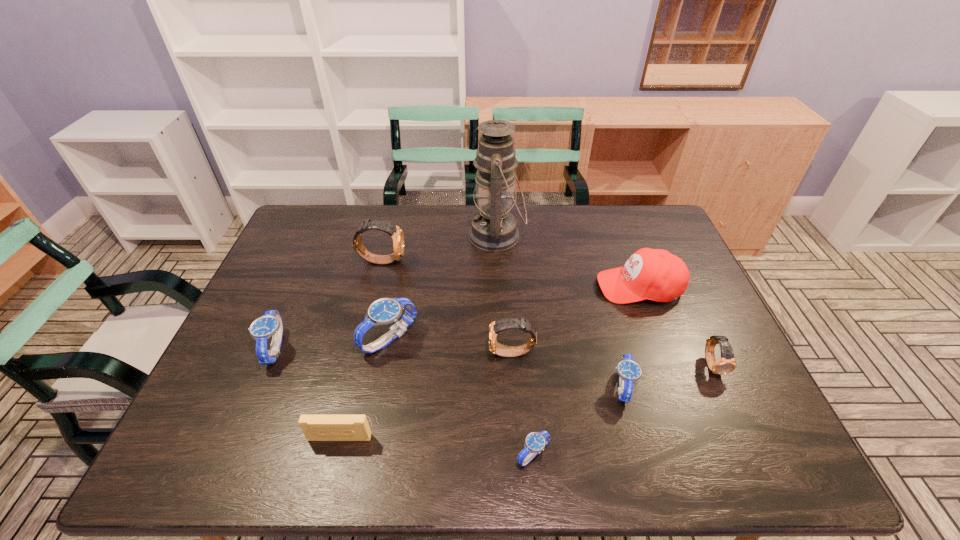
Image resolution: width=960 pixels, height=540 pixels. I want to click on vacant space that is in between the third blue watch from right to left and the shortest watch, so click(461, 396).

Find the location of a particular element. This screenshot has width=960, height=540. vacant space that's between the sixth tallest watch and the leftmost watch is located at coordinates (448, 368).

You are a GUI agent. You are given a task and a screenshot of the screen. Output one action in this format:
    pyautogui.click(x=<x>, y=<y>)
    Task: Click on the free area in between the second shortest watch and the third blue watch from right to left
    
    Given the screenshot: What is the action you would take?
    pyautogui.click(x=506, y=363)

The height and width of the screenshot is (540, 960). In order to click on vacant region between the smallest gold watch and the baseball cap in this screenshot , I will do `click(676, 326)`.

The image size is (960, 540). In order to click on vacant area that lies between the tallest object and the nearest blue watch in this screenshot , I will do `click(515, 345)`.

The height and width of the screenshot is (540, 960). I want to click on free space between the third blue watch from right to left and the leftmost watch, so coord(332,343).

This screenshot has height=540, width=960. I want to click on free space between the rightmost watch and the biggest blue watch, so click(551, 352).

Find the location of a particular element. The width and height of the screenshot is (960, 540). empty space between the rightmost watch and the beige videotape is located at coordinates (526, 401).

The image size is (960, 540). Identify the location of blank region between the second gold watch from left to right and the smallest gold watch. (612, 359).

Locate an element on the screen. This screenshot has width=960, height=540. vacant space in between the rightmost gold watch and the tallest object is located at coordinates 605,300.